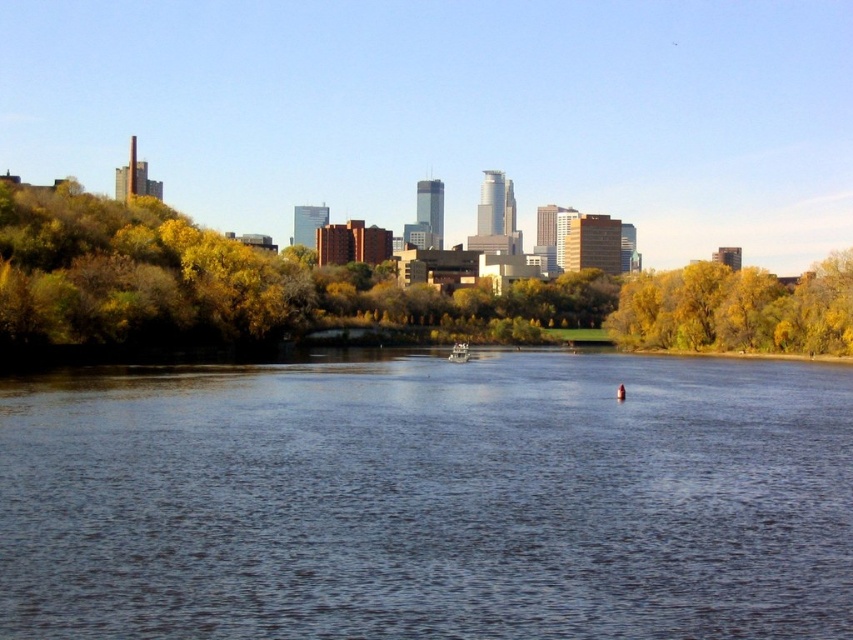
Is yellow-green foliage at center positioned behind wooden boat at center?

No, it is in front of wooden boat at center.

Image resolution: width=853 pixels, height=640 pixels. What do you see at coordinates (354, 291) in the screenshot?
I see `yellow-green foliage at center` at bounding box center [354, 291].

The width and height of the screenshot is (853, 640). I want to click on yellow-green foliage at center, so click(x=354, y=291).

Does blue water at center have a smaller size compared to yellow-green foliage at center?

Yes.

Between blue water at center and yellow-green foliage at center, which one has less height?

blue water at center

The image size is (853, 640). I want to click on blue water at center, so click(x=430, y=500).

The height and width of the screenshot is (640, 853). Describe the element at coordinates (430, 500) in the screenshot. I see `blue water at center` at that location.

Does blue water at center appear over wooden boat at center?

No, blue water at center is not above wooden boat at center.

This screenshot has width=853, height=640. I want to click on blue water at center, so click(430, 500).